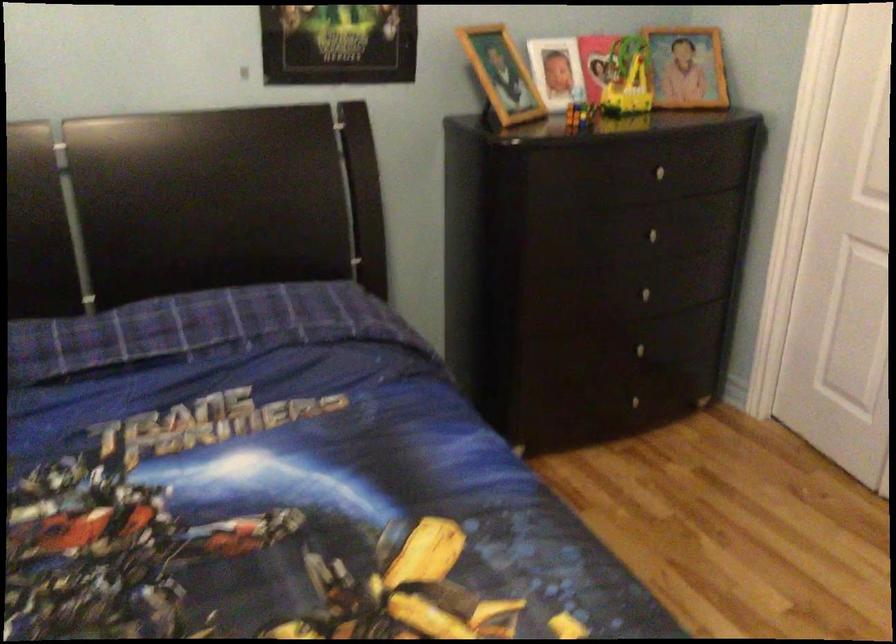
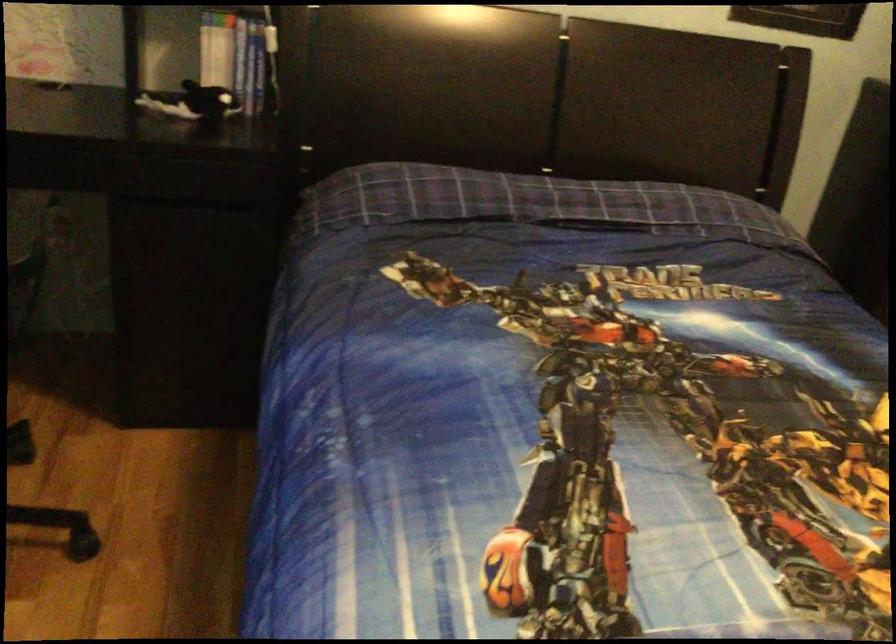
Question: The images are taken continuously from a first-person perspective. In which direction is your viewpoint rotating?

Choices:
 (A) Left
 (B) Right
 (C) Up
 (D) Down

Answer: (A)